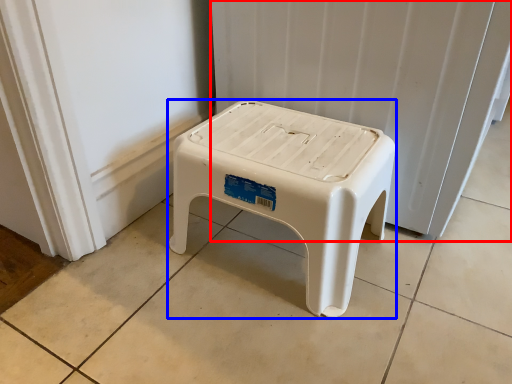
Question: Which point is further to the camera, radiator (highlighted by a red box) or stool (highlighted by a blue box)?

Choices:
 (A) radiator
 (B) stool

Answer: (A)